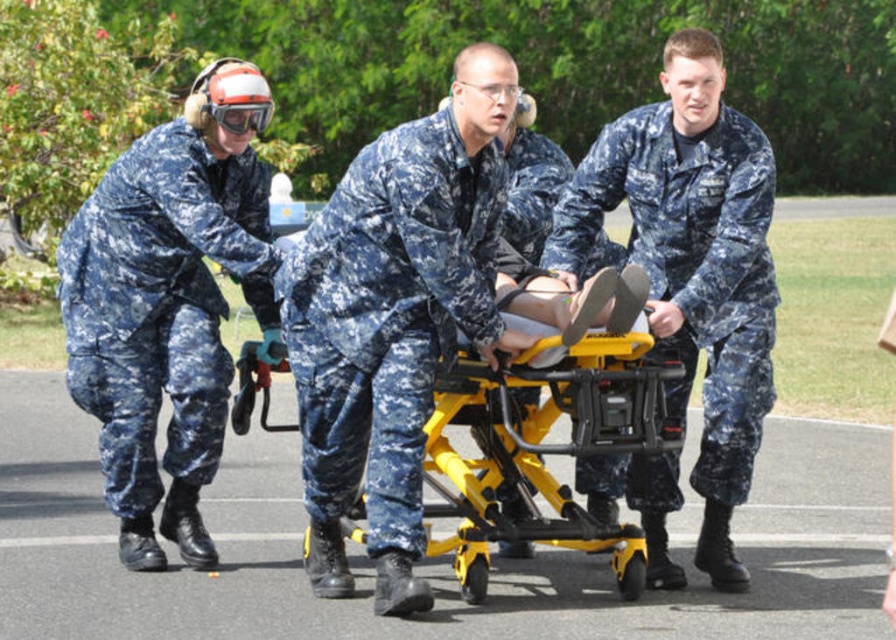
Question: Which point appears closest to the camera in this image?

Choices:
 (A) (575, 193)
 (B) (483, 154)
 (C) (312, 538)

Answer: (B)

Question: Which point is closer to the camera?

Choices:
 (A) (725, 417)
 (B) (329, 481)

Answer: (B)

Question: Is camouflage uniform at left above yellow metallic stretcher at center?

Choices:
 (A) no
 (B) yes

Answer: (B)

Question: Does camouflage uniform at center appear under camouflage fabric uniform at center?

Choices:
 (A) yes
 (B) no

Answer: (A)

Question: Based on their relative distances, which object is farther from the yellow metallic stretcher at center?

Choices:
 (A) camouflage uniform at center
 (B) camouflage fabric uniform at center
 (C) camouflage uniform at left

Answer: (C)

Question: Is camouflage fabric uniform at center wider than yellow metallic stretcher at center?

Choices:
 (A) no
 (B) yes

Answer: (A)